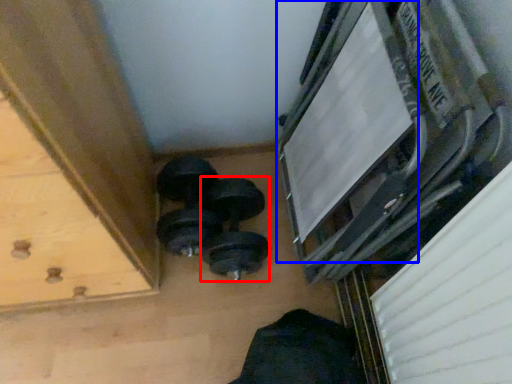
Question: Which of the following is the closest to the observer, dumbbell (highlighted by a red box) or window frame (highlighted by a blue box)?

Choices:
 (A) dumbbell
 (B) window frame

Answer: (B)